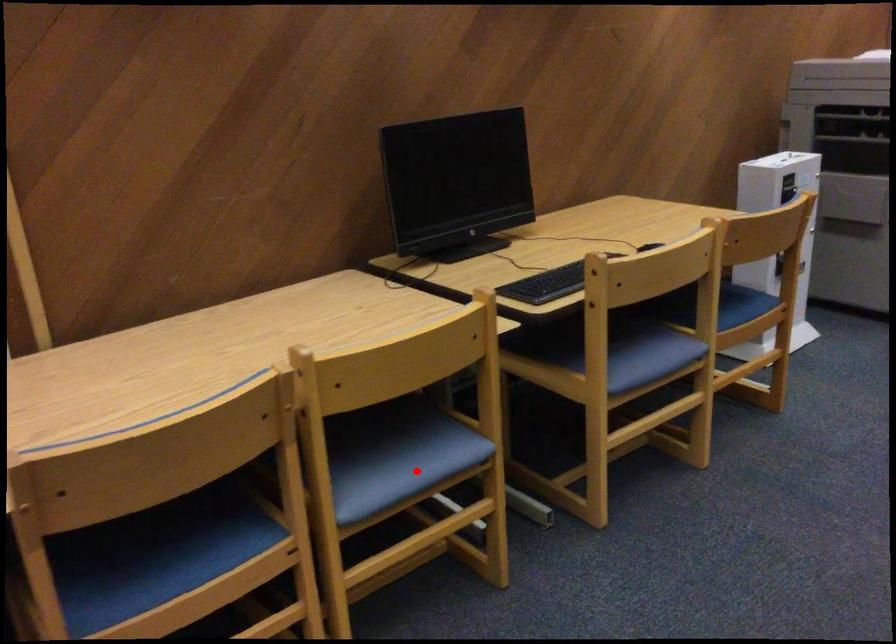
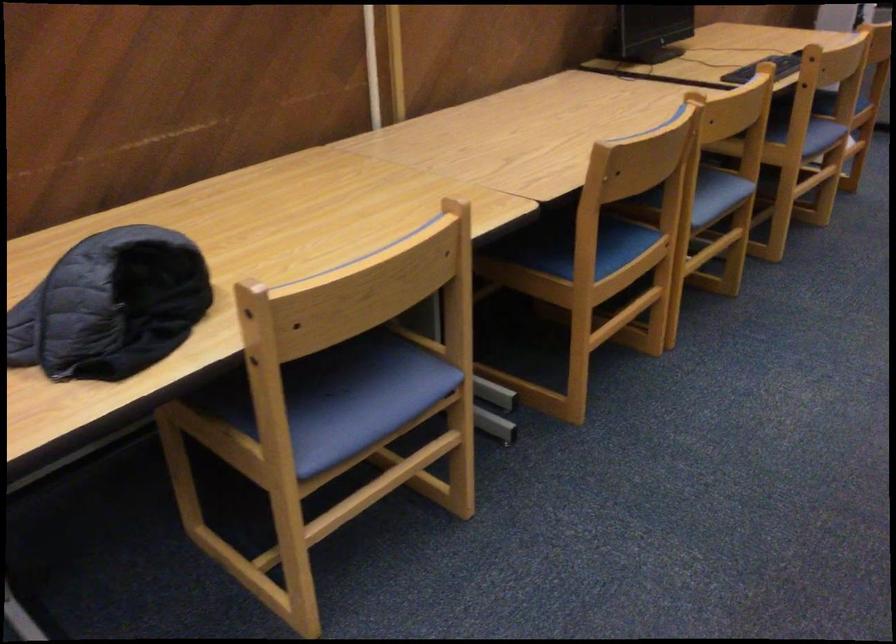
Question: I am providing you with two images of the same scene from different viewpoints. A red point is shown in image1. For the corresponding object point in image2, is it positioned nearer or farther from the camera?

Choices:
 (A) Nearer
 (B) Farther

Answer: (B)